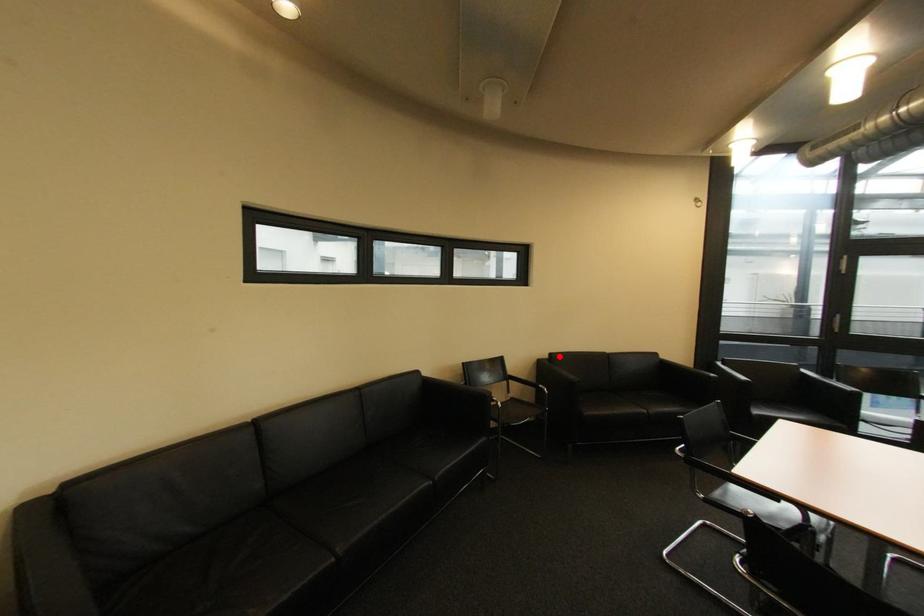
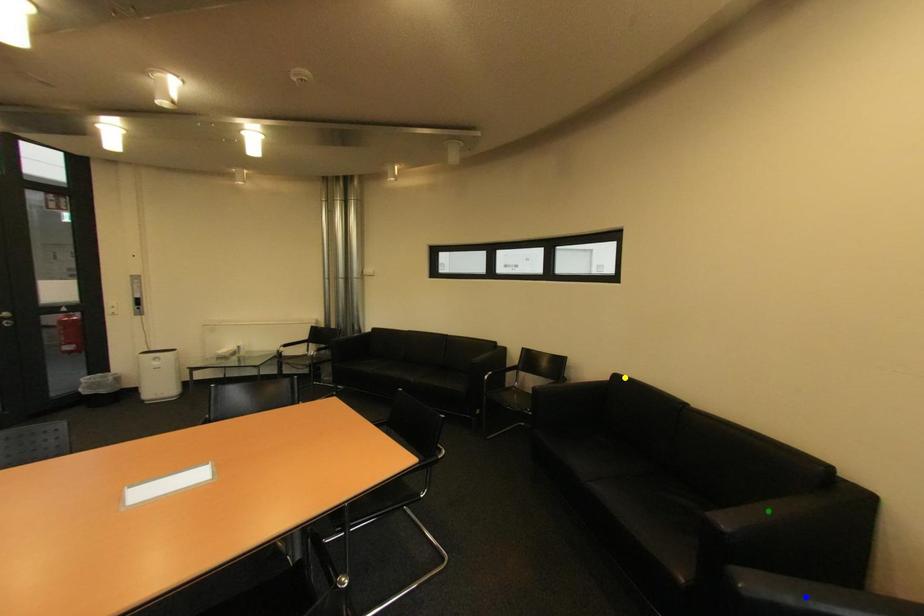
Question: I am providing you with two images of the same scene from different viewpoints. A red point is marked on the first image. You are given multiple points on the second image. In image 2, which mark is for the same physical point as the one in image 1?

Choices:
 (A) yellow point
 (B) green point
 (C) blue point

Answer: (A)